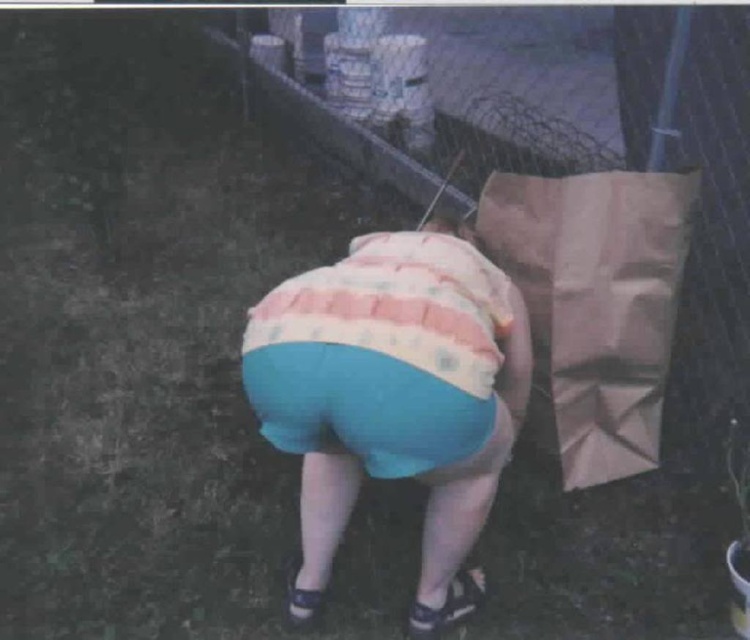
Looking at this image, you are standing at the center of the image and want to place a new object at the same location as the brown paper bag at right. What coordinates should you use?

The coordinates for the brown paper bag at right are at point (596, 305), so you should use those coordinates to place the new object.

You are a photographer trying to capture a clear shot of the striped cotton shirt at center and the black fabric sandal at lower center. However, you notice that one of the objects is blocking the other. Which object is in front and which is being blocked?

The striped cotton shirt at center is in front of the black fabric sandal at lower center, so the sandal is being blocked by the shirt.